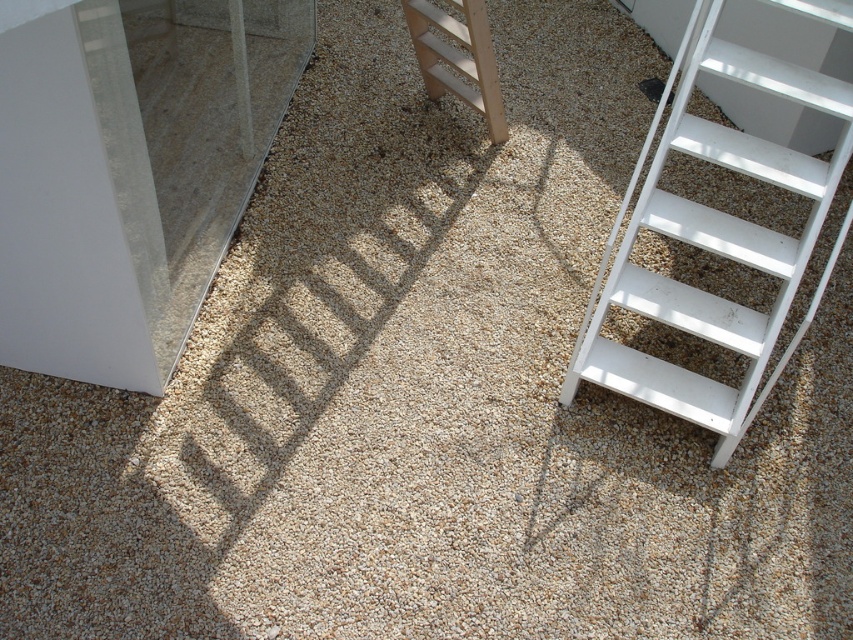
You are standing in the room with the pebble floor. You want to reach a point that is 3.09 meters away from your current position. Can you confirm if the point at coordinates point (837, 8) is exactly that distance away?

Yes, the point (837, 8) is exactly 3.09 meters away from the camera, so it matches the desired distance.

You are a painter who needs to reach a high spot on the wall. You have two ladders available in the room described. The white matte ladder at lower right and the wooden ladder at center. Which ladder is closer to you if you are standing at the center of the room?

The wooden ladder at center is closer to you since you are standing at the center of the room, and the white matte ladder at lower right is 3.96 feet away from it.

You are standing in the room with the pebble floor. You need to place a small potted plant exactly at point (714, 241). Where should you place it?

You should place the small potted plant at the white matte ladder at lower right, since the white matte ladder at lower right is located at point (714, 241).